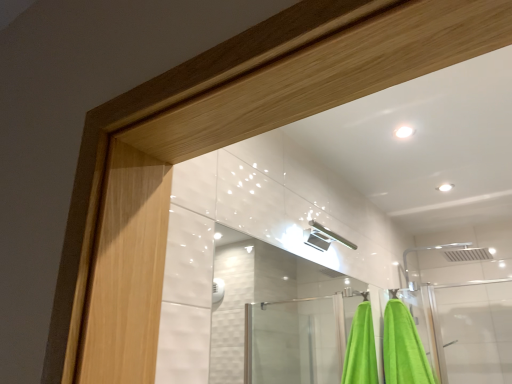
Question: Should I look upward or downward to see green fabric towel at lower right?

Choices:
 (A) down
 (B) up

Answer: (A)